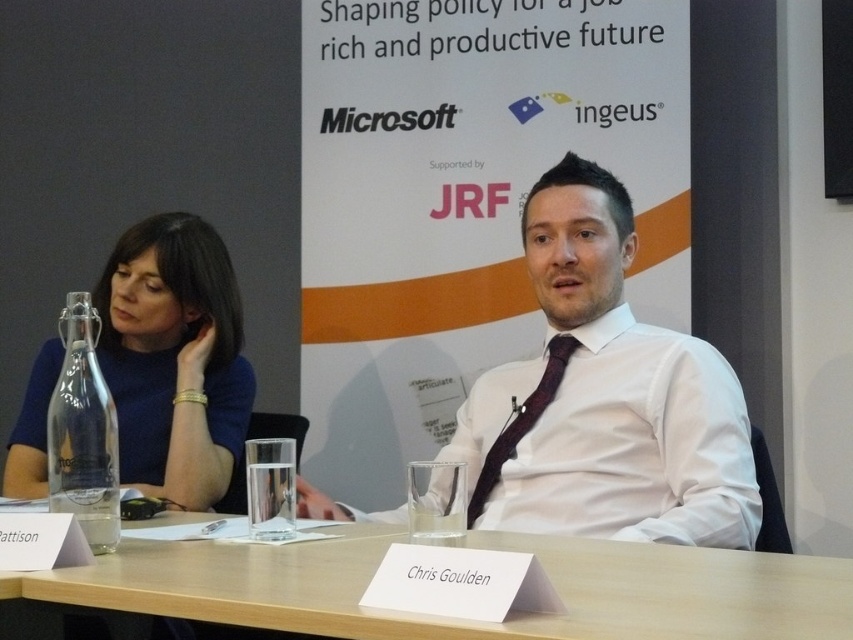
Which is above, light wood table at center or maroon satin tie at center?

maroon satin tie at center is higher up.

What do you see at coordinates (459, 620) in the screenshot? This screenshot has height=640, width=853. I see `light wood table at center` at bounding box center [459, 620].

Identify the location of light wood table at center. This screenshot has height=640, width=853. (x=459, y=620).

Is white shirt at center below maroon satin tie at center?

No, white shirt at center is not below maroon satin tie at center.

Which is behind, point (741, 474) or point (566, 364)?

The point (566, 364) is behind.

Between point (508, 464) and point (552, 344), which one is positioned in front?

Positioned in front is point (508, 464).

Image resolution: width=853 pixels, height=640 pixels. Find the location of `white shirt at center`. white shirt at center is located at coordinates (604, 397).

Can you confirm if white shirt at center is positioned to the right of light wood table at center?

Correct, you'll find white shirt at center to the right of light wood table at center.

Between point (454, 454) and point (59, 582), which one is positioned behind?

Point (454, 454)

Does point (631, 376) come in front of point (651, 604)?

No.

Image resolution: width=853 pixels, height=640 pixels. Find the location of `white shirt at center`. white shirt at center is located at coordinates (604, 397).